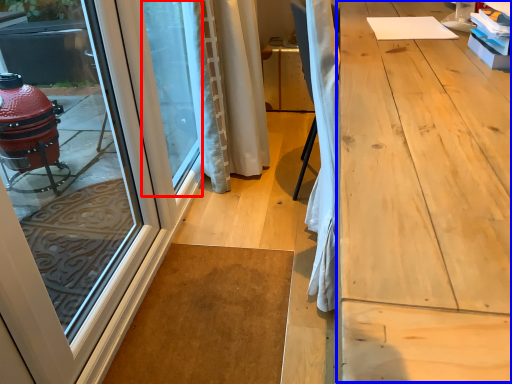
Question: Which point is further to the camera, window screen (highlighted by a red box) or workbench (highlighted by a blue box)?

Choices:
 (A) window screen
 (B) workbench

Answer: (A)